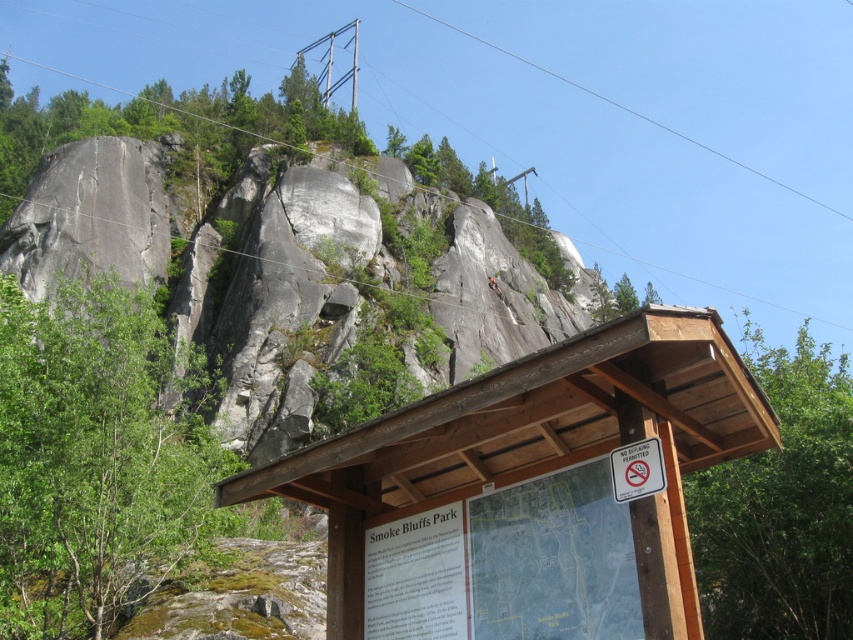
Based on the photo, you are a park visitor holding a 1.2 meter long hiking pole. You want to walk from the wooden signboard at lower right to the clear wire at upper center. Is there enough space between them for your pole to pass without bending?

The wooden signboard at lower right is closer to the viewer than the clear wire at upper center. Since the distance between them isn

You are a park ranger checking the safety of the Smoke Bluffs Park signboard. You notice the clear wire at upper center and the white plastic sign at lower right. Which object is taller?

The clear wire at upper center is taller than the white plastic sign at lower right according to the description.